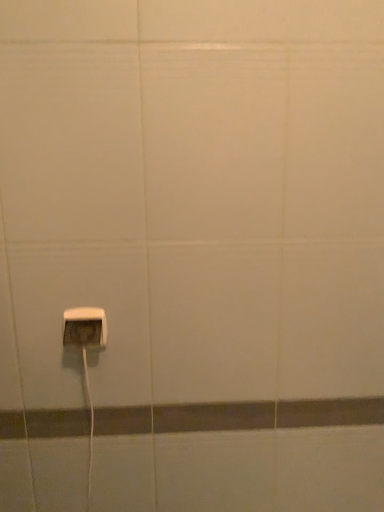
Find the location of a particular element. The height and width of the screenshot is (512, 384). white plastic power plug at lower left is located at coordinates (85, 327).

The image size is (384, 512). What do you see at coordinates (85, 327) in the screenshot? I see `white plastic power plug at lower left` at bounding box center [85, 327].

Locate an element on the screen. white plastic power plug at lower left is located at coordinates (85, 327).